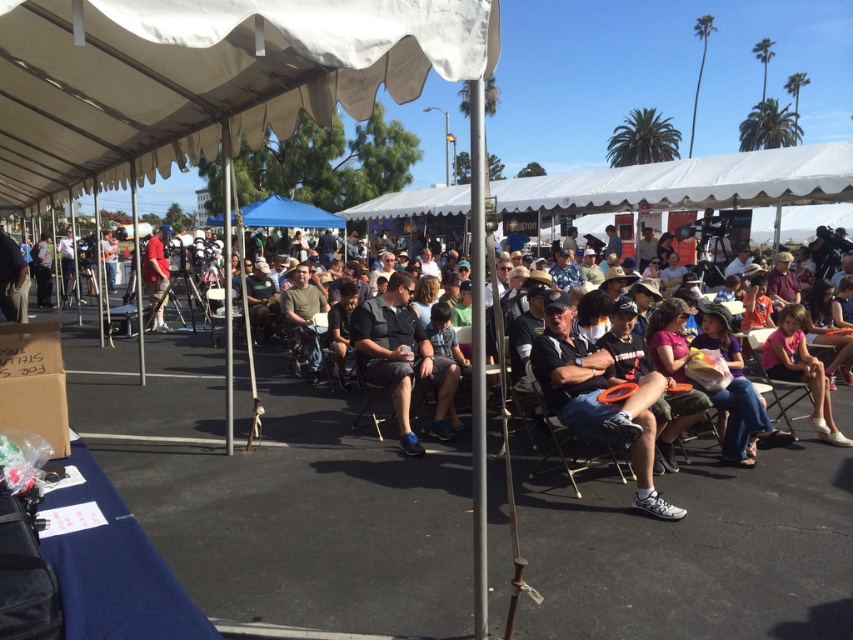
You are standing at the entrance of the event area and notice both the silver metallic pole at center and the matte red shirt at center. From your perspective, which object is positioned to the right?

The silver metallic pole at center is to the right of the matte red shirt at center, so the silver metallic pole at center is positioned to the right.

In the scene shown: You are an event organizer trying to locate two volunteers wearing a dark gray fabric shirt at center and a matte red shirt at center. Which volunteer is closer to the front of the event area?

The dark gray fabric shirt at center is in front of the matte red shirt at center, so the volunteer wearing the dark gray fabric shirt at center is closer to the front of the event area.